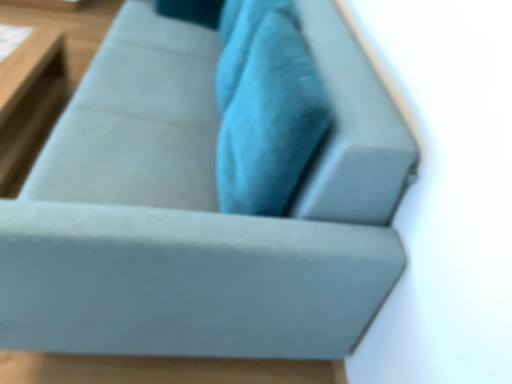
This screenshot has height=384, width=512. What do you see at coordinates (29, 96) in the screenshot?
I see `wooden table at left` at bounding box center [29, 96].

Find the location of `wooden table at left`. wooden table at left is located at coordinates (29, 96).

At what (x,y) coordinates should I click in order to perform the action: click on wooden table at left. Please return your answer as a coordinate pair (x, y). The width and height of the screenshot is (512, 384). Looking at the image, I should click on (29, 96).